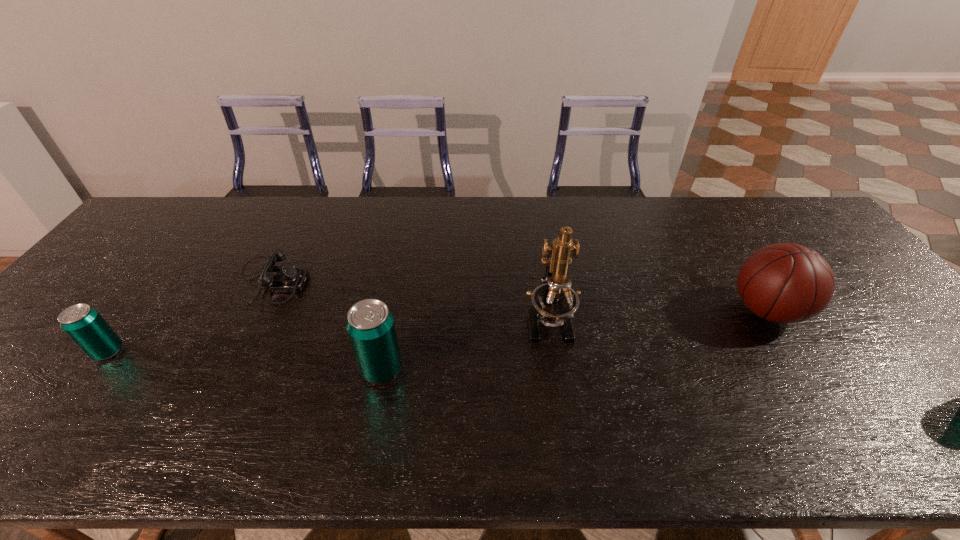
The width and height of the screenshot is (960, 540). Find the location of `the leftmost object`. the leftmost object is located at coordinates (83, 324).

At what (x,y) coordinates should I click in order to perform the action: click on the left beer can. Please return your answer as a coordinate pair (x, y). The image size is (960, 540). Looking at the image, I should click on (83, 324).

Identify the location of the third object from left to right. The height and width of the screenshot is (540, 960). point(370,325).

You are a GUI agent. You are given a task and a screenshot of the screen. Output one action in this format:
    pyautogui.click(x=<x>, y=<y>)
    Task: Click on the taller beer can
    This screenshot has height=540, width=960.
    Given the screenshot: What is the action you would take?
    pyautogui.click(x=370, y=325)

Where is `the rightmost object`? This screenshot has width=960, height=540. the rightmost object is located at coordinates (784, 283).

At what (x,y) coordinates should I click in order to perform the action: click on the fourth object from right to left. Please return your answer as a coordinate pair (x, y). The width and height of the screenshot is (960, 540). Looking at the image, I should click on (286, 278).

This screenshot has width=960, height=540. I want to click on telephone, so click(286, 278).

The height and width of the screenshot is (540, 960). In order to click on microscope in this screenshot , I will do (554, 302).

Find the location of a particular element. This screenshot has width=960, height=540. the fourth object from left to right is located at coordinates (554, 302).

Locate an element on the screen. vacant space located on the right of the fourth tallest object is located at coordinates (258, 352).